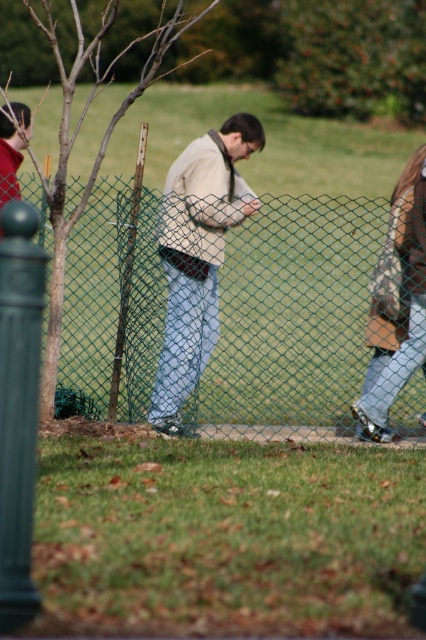
You are a photographer trying to capture both the camouflage jacket at right and the matte black jacket at left in a single shot. Given their height difference, which jacket would appear larger in the photo?

The camouflage jacket at right appears larger in the photo because it is much taller than the matte black jacket at left.